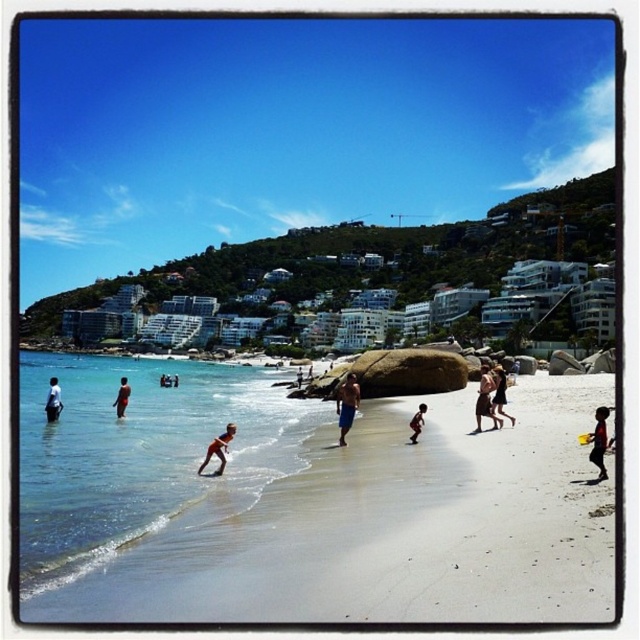
Question: Which object appears farthest from the camera in this image?

Choices:
 (A) tan skin person at lower center
 (B) silhouette wooden stick at center
 (C) matte black shorts at left
 (D) smooth sand beach at lower center

Answer: (C)

Question: Which point is farther from the camera taking this photo?

Choices:
 (A) (113, 401)
 (B) (244, 493)

Answer: (A)

Question: Can you confirm if blue denim shorts at center is positioned below brown fabric dress at center-right?

Choices:
 (A) yes
 (B) no

Answer: (A)

Question: Is clear blue water at lower left below matte black person at left?

Choices:
 (A) yes
 (B) no

Answer: (A)

Question: Which point is farther to the camera?

Choices:
 (A) (417, 406)
 (B) (124, 394)
 (C) (376, 557)

Answer: (A)

Question: Observing the image, what is the correct spatial positioning of brown fabric dress at center-right in reference to matte black shorts at left?

Choices:
 (A) left
 (B) right

Answer: (B)